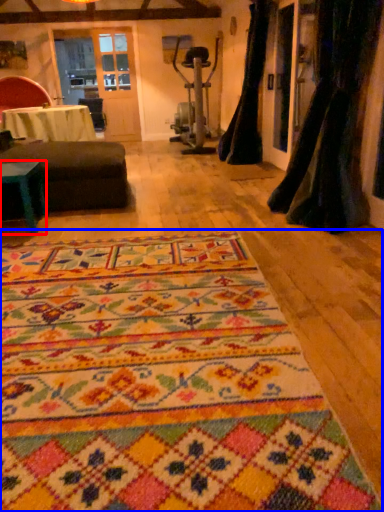
Question: Which point is closer to the camera, table (highlighted by a red box) or mat (highlighted by a blue box)?

Choices:
 (A) table
 (B) mat

Answer: (B)